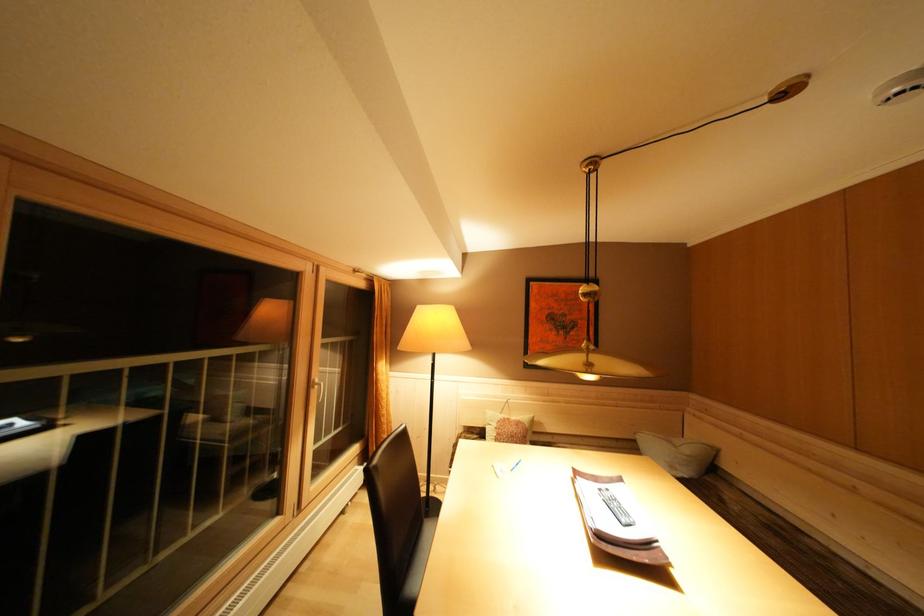
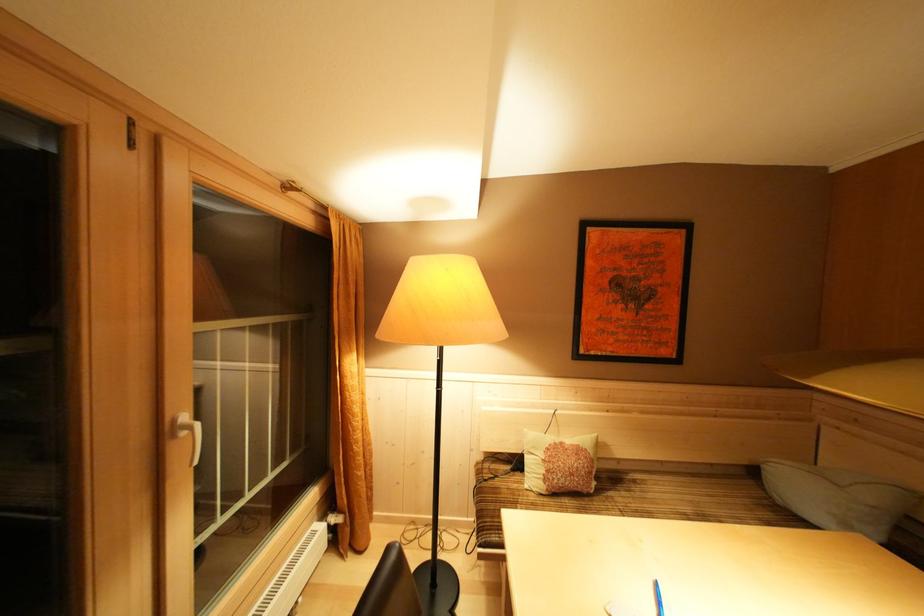
Question: The images are taken continuously from a first-person perspective. In which direction is your viewpoint rotating?

Choices:
 (A) Left
 (B) Right
 (C) Up
 (D) Down

Answer: (D)